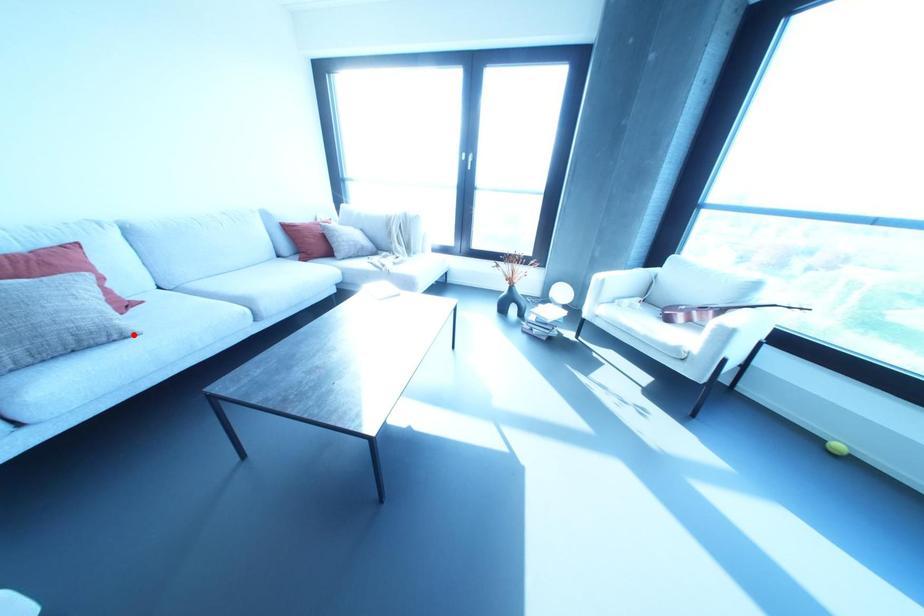
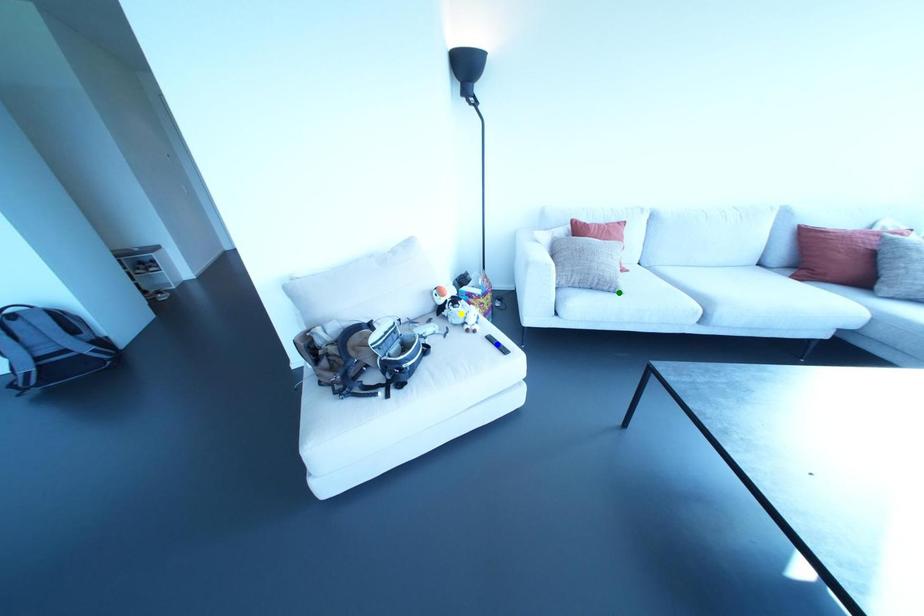
Question: I am providing you with two images of the same scene from different viewpoints. A red point is marked on the first image. You are given multiple points on the second image. Which spot in image 2 lines up with the point in image 1?

Choices:
 (A) green point
 (B) yellow point
 (C) blue point

Answer: (A)